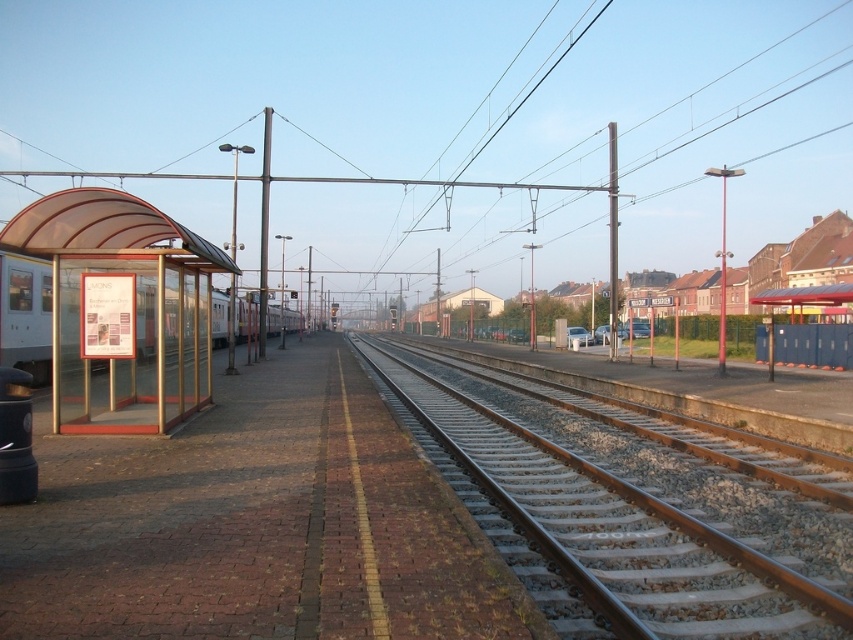
Is point (202, 304) more distant than point (35, 284)?

No.

Does point (123, 275) come farther from viewer compared to point (0, 282)?

That is False.

You are a GUI agent. You are given a task and a screenshot of the screen. Output one action in this format:
    pyautogui.click(x=<x>, y=<y>)
    Task: Click on the transparent plastic bus stop at left
    
    Given the screenshot: What is the action you would take?
    pyautogui.click(x=122, y=308)

Based on the photo, can you confirm if metal/rustic track at center is positioned above transparent plastic bus stop at left?

Actually, metal/rustic track at center is below transparent plastic bus stop at left.

Measure the distance between metal/rustic track at center and transparent plastic bus stop at left.

They are 24.19 feet apart.

The image size is (853, 640). What are the coordinates of `metal/rustic track at center` in the screenshot? It's located at (614, 531).

Where is `metal/rustic track at center`? The image size is (853, 640). metal/rustic track at center is located at coordinates (614, 531).

Between metal/rustic track at center and silver metallic train at left, which one appears on the left side from the viewer's perspective?

From the viewer's perspective, silver metallic train at left appears more on the left side.

Which is in front, point (483, 451) or point (276, 310)?

Point (483, 451) is more forward.

Where is `metal/rustic track at center`? This screenshot has width=853, height=640. metal/rustic track at center is located at coordinates (614, 531).